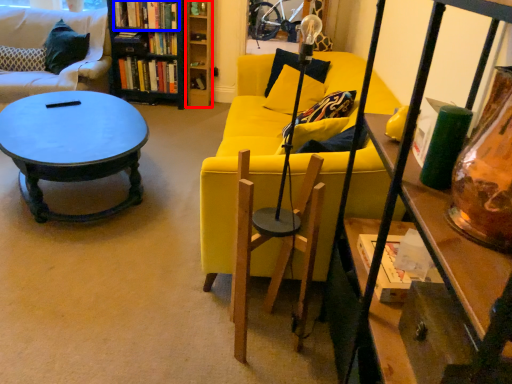
Question: Which point is further to the camera, shelf (highlighted by a red box) or book (highlighted by a blue box)?

Choices:
 (A) shelf
 (B) book

Answer: (A)